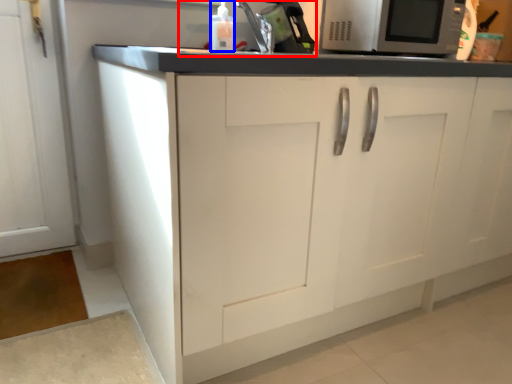
Question: Which of the following is the farthest to the observer, sink (highlighted by a red box) or bottle (highlighted by a blue box)?

Choices:
 (A) sink
 (B) bottle

Answer: (A)